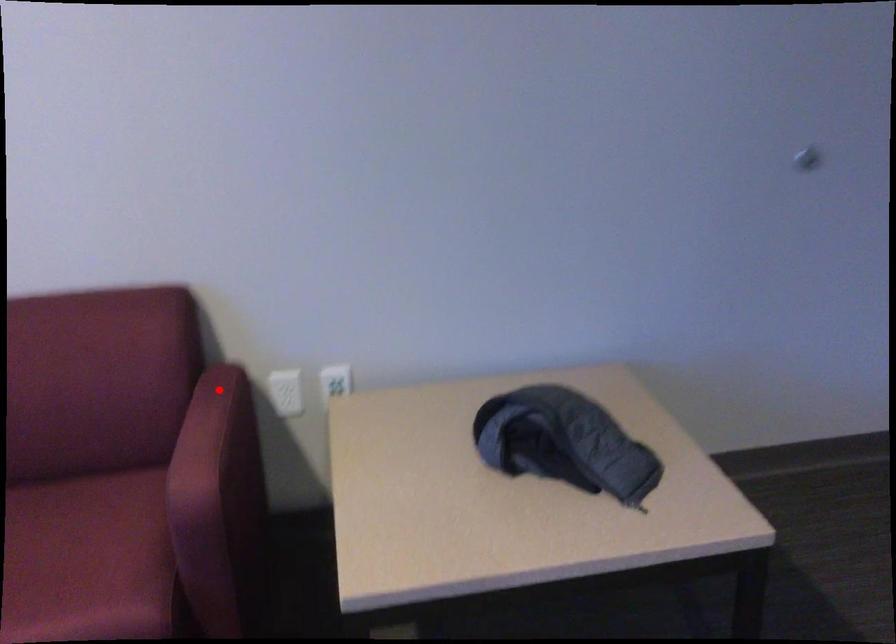
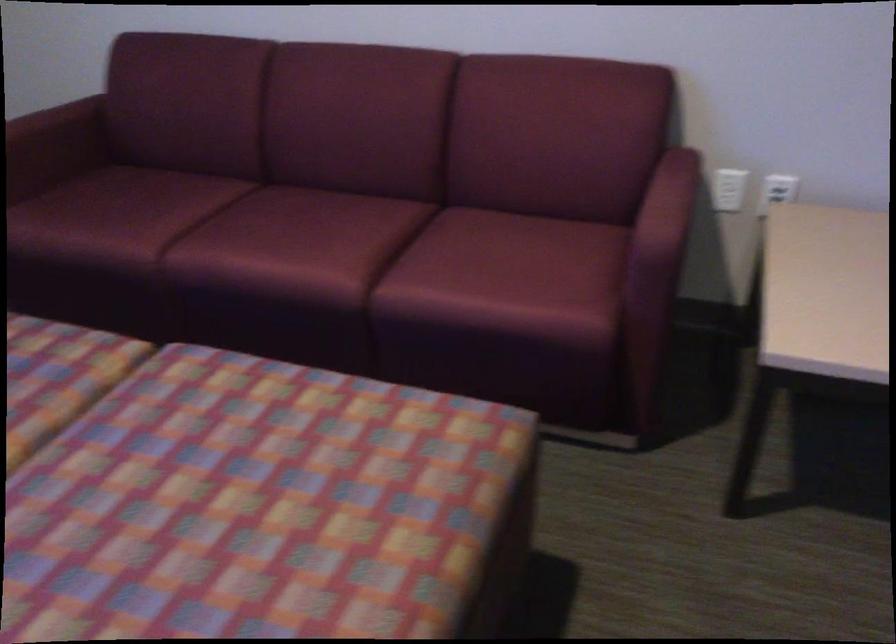
Find the pixel in the second image that matches the highlighted location in the first image.

(678, 166)